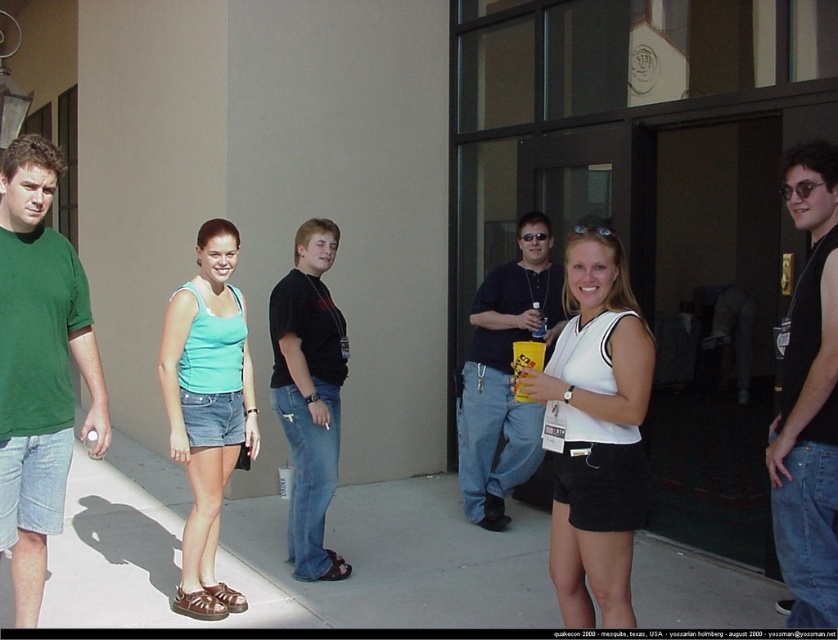
Question: Which of the following is the closest to the observer?

Choices:
 (A) white matte tank top at center
 (B) teal fabric tank top at center

Answer: (A)

Question: Does smooth concrete pavement at center appear over black sleeveless shirt at center?

Choices:
 (A) no
 (B) yes

Answer: (A)

Question: Estimate the real-world distances between objects in this image. Which object is farther from the teal fabric tank top at center?

Choices:
 (A) white matte tank top at center
 (B) green matte t-shirt at left
 (C) matte black shirt at center

Answer: (C)

Question: Observing the image, what is the correct spatial positioning of smooth concrete pavement at center in reference to matte black shirt at center?

Choices:
 (A) right
 (B) left

Answer: (B)

Question: Is smooth concrete pavement at center to the left of black cotton shirt at center from the viewer's perspective?

Choices:
 (A) no
 (B) yes

Answer: (A)

Question: Which of the following is the closest to the observer?

Choices:
 (A) white matte tank top at center
 (B) black cotton shirt at center

Answer: (A)